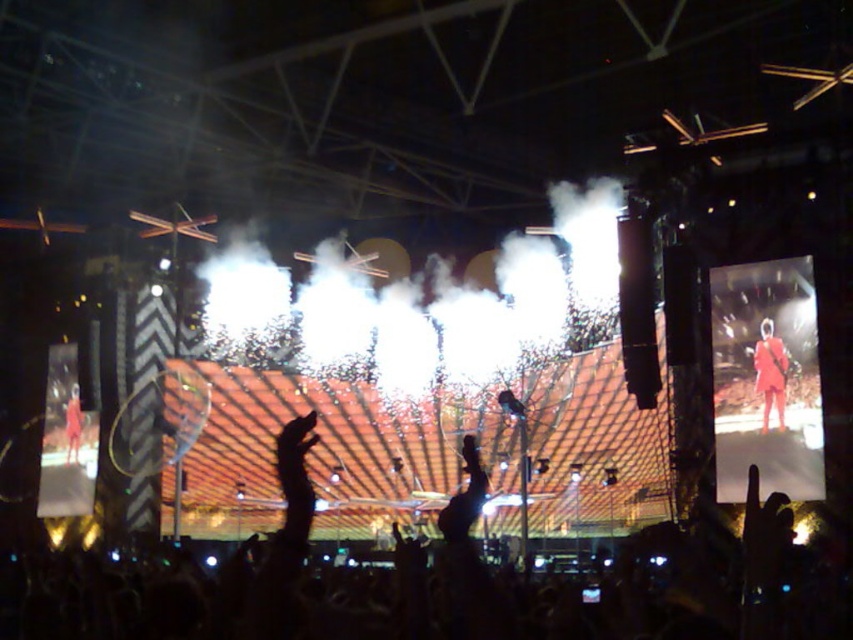
Between point (462, 442) and point (65, 404), which one is positioned behind?

Positioned behind is point (462, 442).

Based on the photo, who is lower down, black matte hand at center or orange fabric person at left?

black matte hand at center is below.

Who is more distant from viewer, (462, 442) or (74, 436)?

The point (462, 442) is behind.

Image resolution: width=853 pixels, height=640 pixels. In order to click on black matte hand at center in this screenshot , I will do `click(465, 496)`.

Locate an element on the screen. This screenshot has height=640, width=853. black matte hand at center is located at coordinates (465, 496).

Does matte red dress at center appear over orange fabric person at left?

Correct, matte red dress at center is located above orange fabric person at left.

Based on the photo, is matte red dress at center positioned at the back of orange fabric person at left?

No.

The height and width of the screenshot is (640, 853). I want to click on matte red dress at center, so click(x=770, y=372).